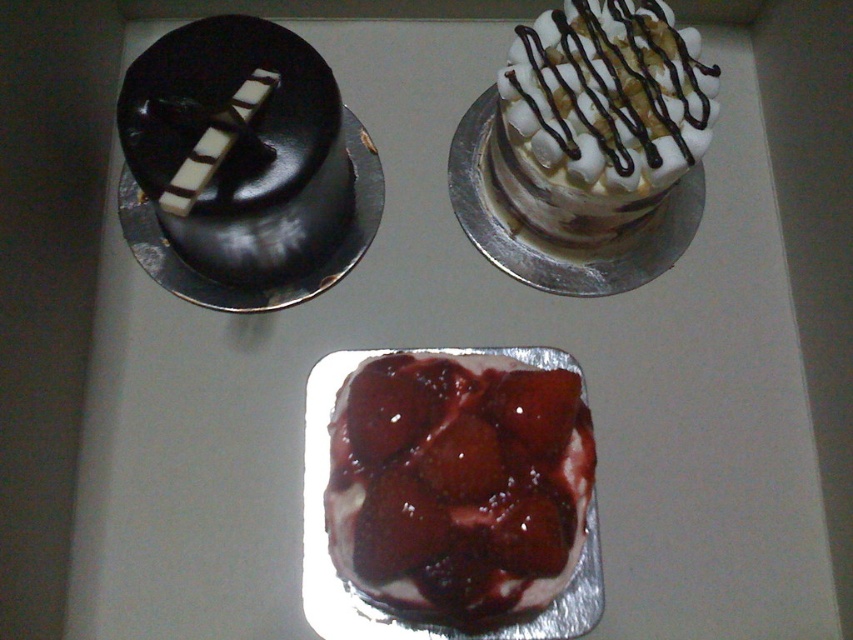
You are a dessert delivery person who needs to place a 25 cm wide box between the white marshmallow cake at upper right and the smooth chocolate cake at upper left. Can the box fit between them without overlapping either dessert?

The distance between the white marshmallow cake at upper right and the smooth chocolate cake at upper left is 26.69 centimeters. Since the box is 25 cm wide, it can fit between them as there is enough space.